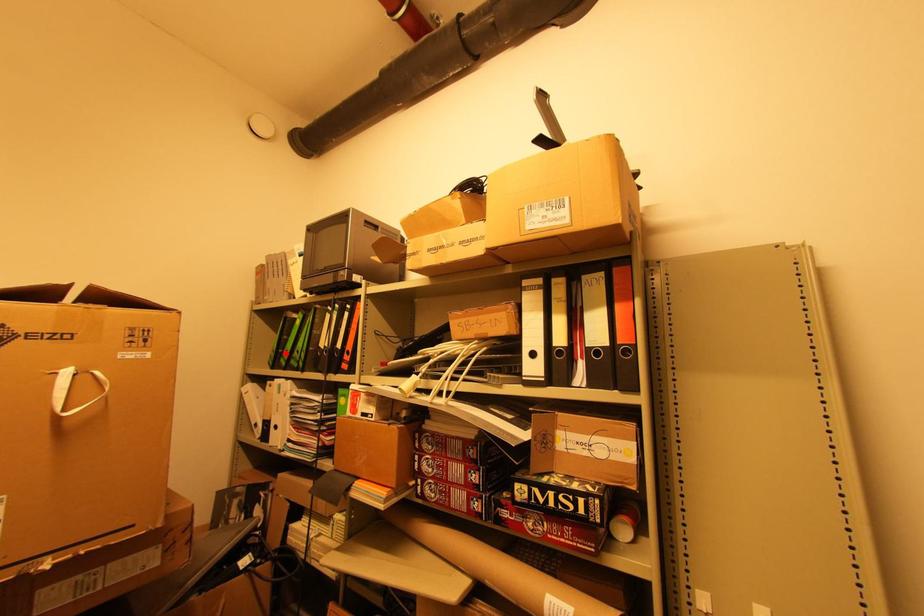
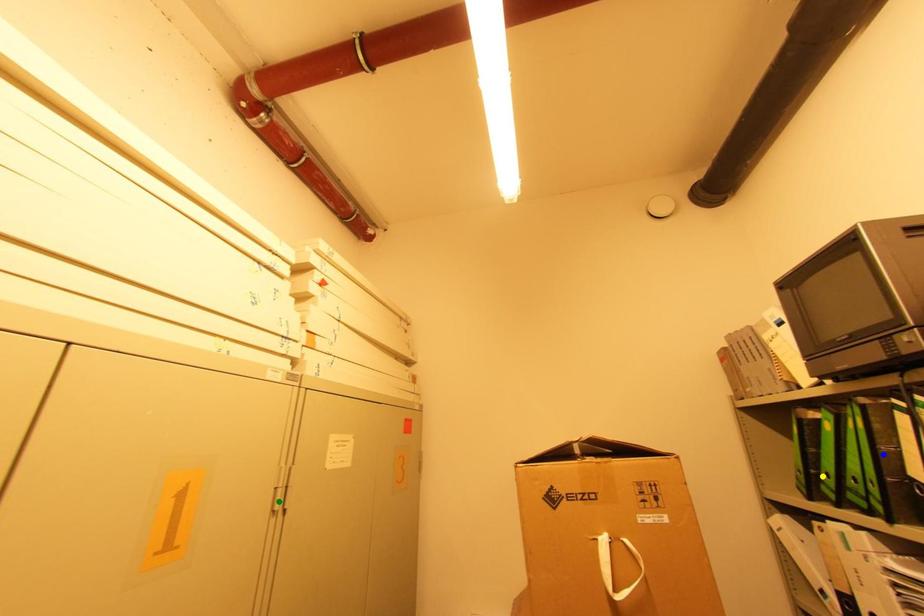
Question: I am providing you with two images of the same scene from different viewpoints. A red point is marked on the first image. You are given multiple points on the second image. Which point in image 2 represents the same 3d spot as the red point in image 1?

Choices:
 (A) blue point
 (B) yellow point
 (C) green point

Answer: (B)